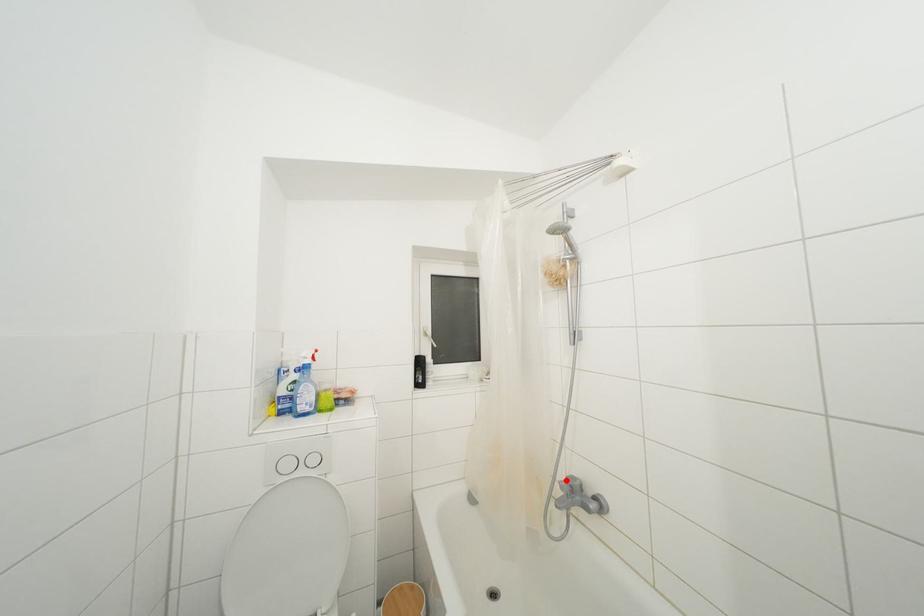
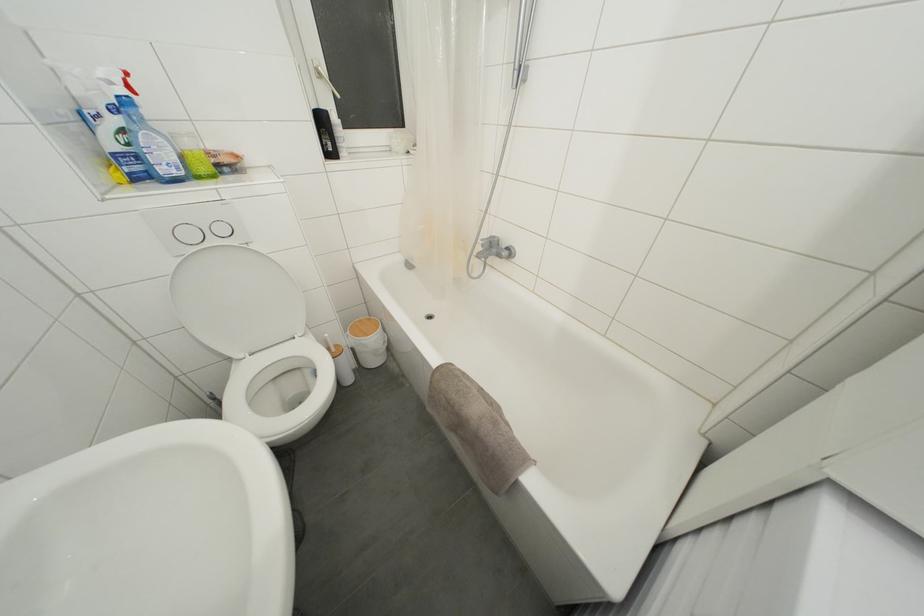
Locate, in the second image, the point that corresponds to the highlighted location in the first image.

(488, 240)